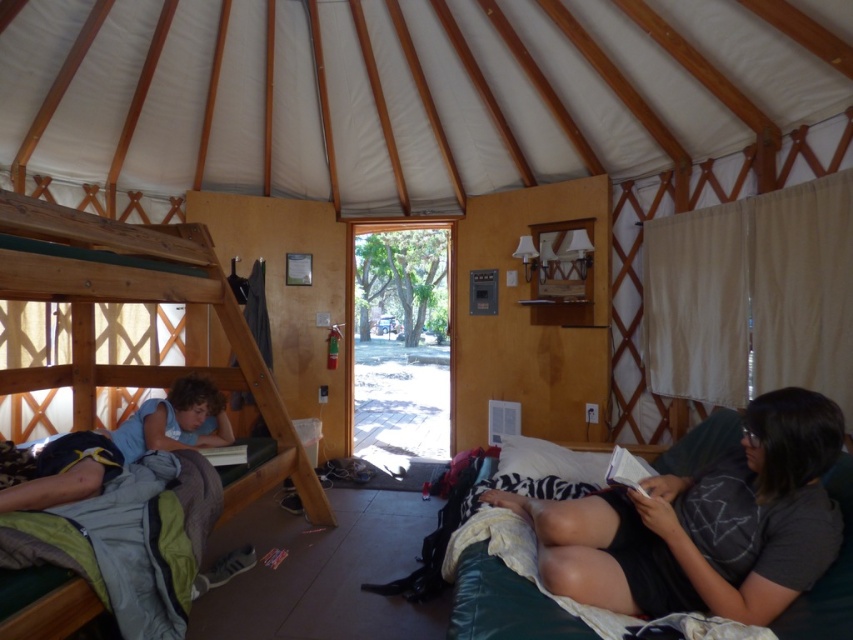
Question: Is white fabric canopy at upper center to the left of light blue t-shirt at lower left from the viewer's perspective?

Choices:
 (A) yes
 (B) no

Answer: (B)

Question: Considering the relative positions of white fabric canopy at upper center and light blue t-shirt at lower left in the image provided, where is white fabric canopy at upper center located with respect to light blue t-shirt at lower left?

Choices:
 (A) below
 (B) above

Answer: (B)

Question: Which is nearer to the white fabric canopy at upper center?

Choices:
 (A) wooden bunk bed at left
 (B) dark gray cotton shirt at lower right

Answer: (A)

Question: Which object appears closest to the camera in this image?

Choices:
 (A) dark gray cotton shirt at lower right
 (B) light blue t-shirt at lower left

Answer: (A)

Question: Is white fabric canopy at upper center to the right of wooden bunk bed at left from the viewer's perspective?

Choices:
 (A) yes
 (B) no

Answer: (A)

Question: Which is nearer to the light blue t-shirt at lower left?

Choices:
 (A) wooden bunk bed at left
 (B) white fabric canopy at upper center

Answer: (A)